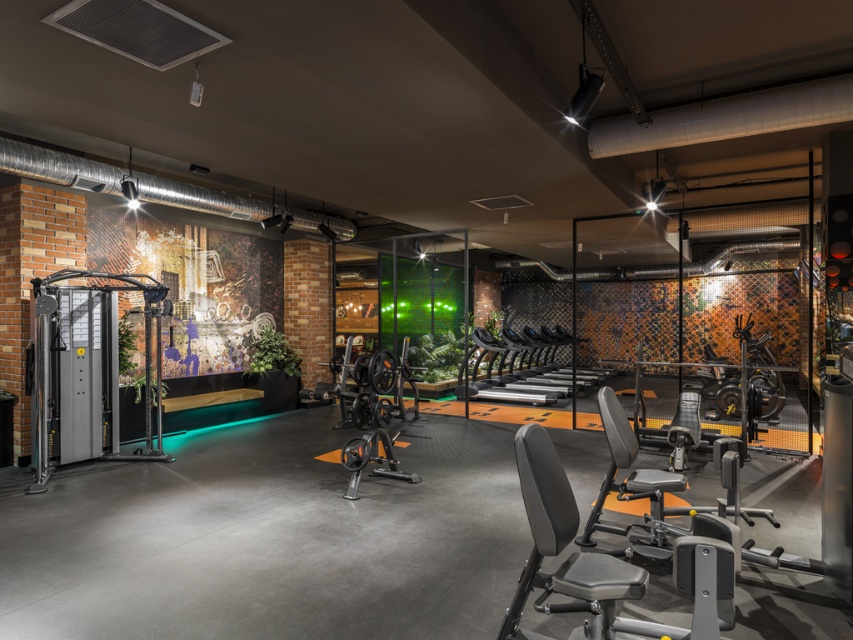
Is point (113, 458) positioned before point (380, 420)?

No, it is not.

Does silver metallic weight machine at left have a greater width compared to black textured weight bench at center?

Yes.

Is point (70, 348) farther from viewer compared to point (347, 458)?

Yes, point (70, 348) is farther from viewer.

The width and height of the screenshot is (853, 640). Find the location of `silver metallic weight machine at left`. silver metallic weight machine at left is located at coordinates (86, 368).